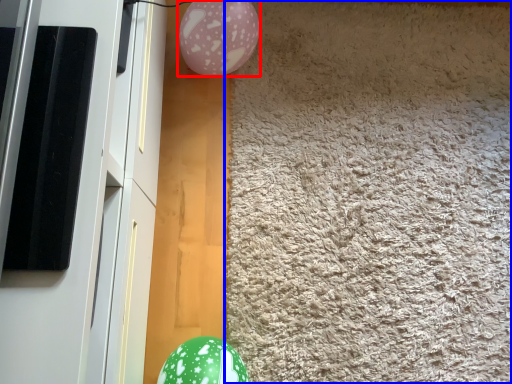
Question: Which object appears farthest to the camera in this image, balloon (highlighted by a red box) or mat (highlighted by a blue box)?

Choices:
 (A) balloon
 (B) mat

Answer: (A)